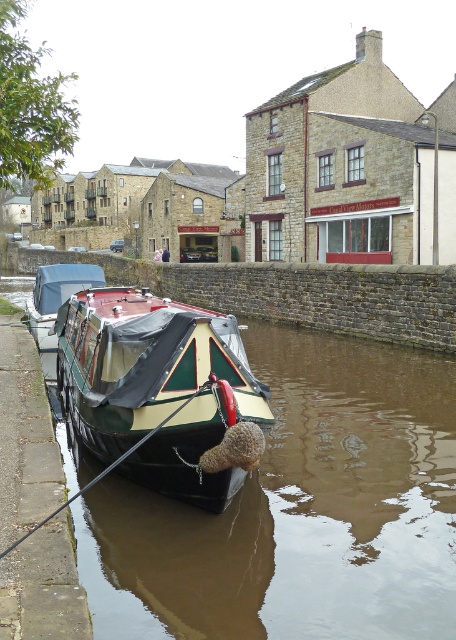
You are standing on the stone embankment next to the canal. You see two boats at the center of the image, a green painted wood boat at center and a green matte boat at center. Which boat is closer to you?

The green painted wood boat at center is closer to you since it is only 7.84 feet away from the green matte boat at center, implying it is nearer to the embankment where you are standing.

You are standing on the stone embankment of the canal and want to walk towards the two points marked in the scene. Which point, point (114, 493) or point (109, 396), will you reach first?

You will reach point (114, 493) first because it is closer to you than point (109, 396), which is further away.

In the scene shown: You are standing on the stone embankment next to the canal and see both the green matte boat at center and the green polished wood boat at center. Which boat is closer to your left side?

The green matte boat at center is closer to your left side because it is positioned to the left of the green polished wood boat at center.